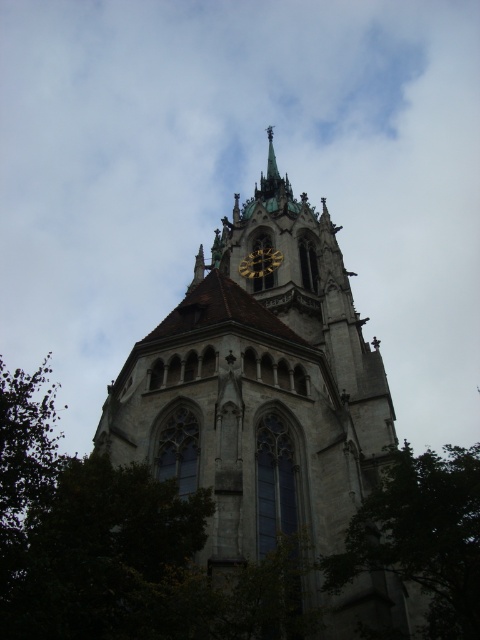
You are an architect analyzing the placement of a new statue in front of the Gothic church tower. The statue will be positioned such that its base must align with the exact 2D coordinates of the white cloud at upper center shown in the image. What are the coordinates where you should place the statue?

The coordinates for the white cloud at upper center are at point (239, 176). Therefore, the statue should be placed at those exact coordinates.

You are standing at the center of the image. Which direction should you face to see the green leafy tree at lower right?

The green leafy tree at lower right is located at coordinates point (420, 536), which is in the lower right direction from your current position at the center. Face towards the lower right direction to see it.